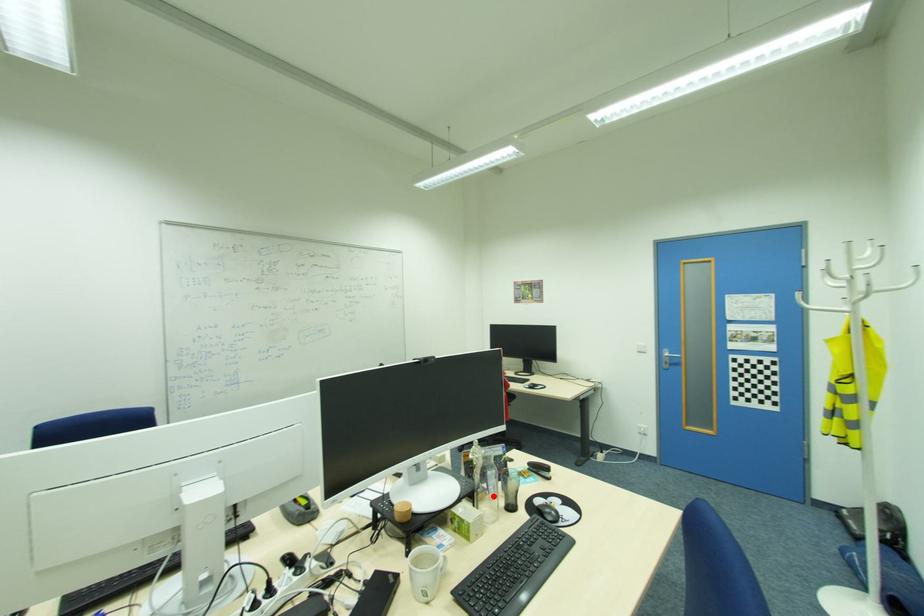
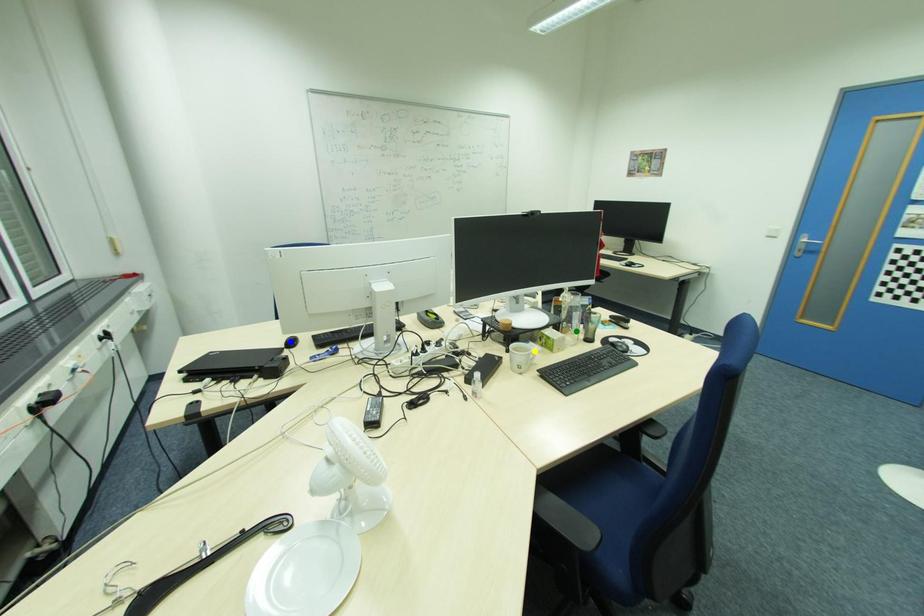
Question: I am providing you with two images of the same scene from different viewpoints. A red point is marked on the first image. You are given multiple points on the second image. Which spot in image 2 lines up with the point in image 1?

Choices:
 (A) green point
 (B) blue point
 (C) yellow point

Answer: (A)